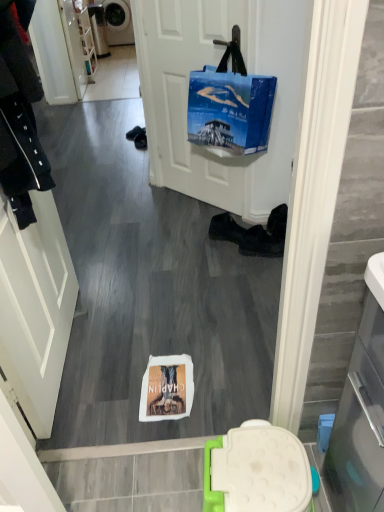
This screenshot has height=512, width=384. Find the location of `empty space that is in between white glossy door at left and black leather shoes at center, acting as the 2th footwear starting from the right`. empty space that is in between white glossy door at left and black leather shoes at center, acting as the 2th footwear starting from the right is located at coordinates (141, 292).